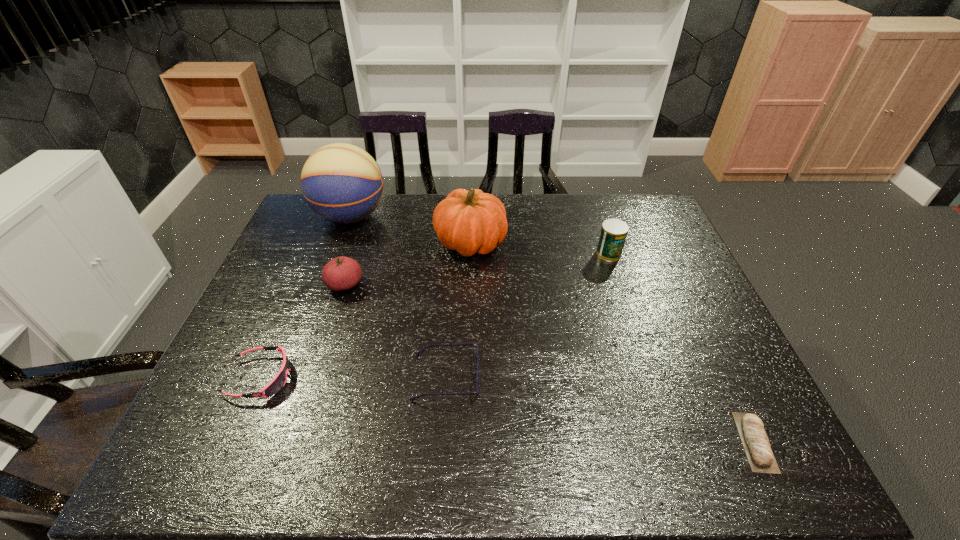
Identify the location of vacant region that satisfies the following two spatial constraints: 1. on the patterned surface of the pumpkin; 2. on the right side of the tallest object. (341, 242).

The width and height of the screenshot is (960, 540). I want to click on vacant region that satisfies the following two spatial constraints: 1. on the front-facing side of the goggles; 2. on the left side of the nearest object, so click(x=232, y=442).

You are a GUI agent. You are given a task and a screenshot of the screen. Output one action in this format:
    pyautogui.click(x=<x>, y=<y>)
    Task: Click on the vacant space that satisfies the following two spatial constraints: 1. on the patterned surface of the basketball; 2. on the right side of the pumpkin
    
    Given the screenshot: What is the action you would take?
    pyautogui.click(x=341, y=242)